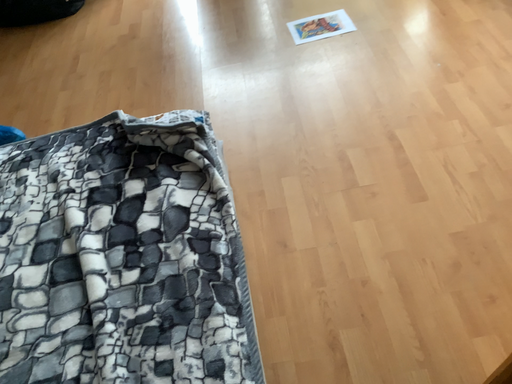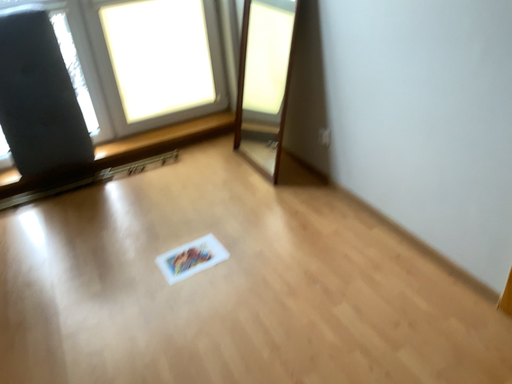
Question: How did the camera likely rotate when shooting the video?

Choices:
 (A) rotated upward
 (B) rotated downward

Answer: (A)